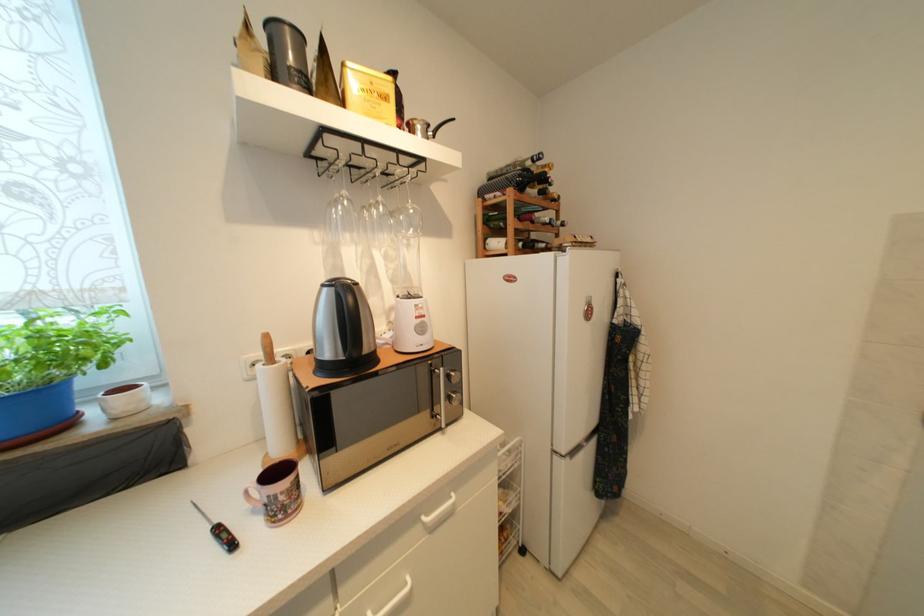
Identify the location of black canister. The height and width of the screenshot is (616, 924). (286, 54).